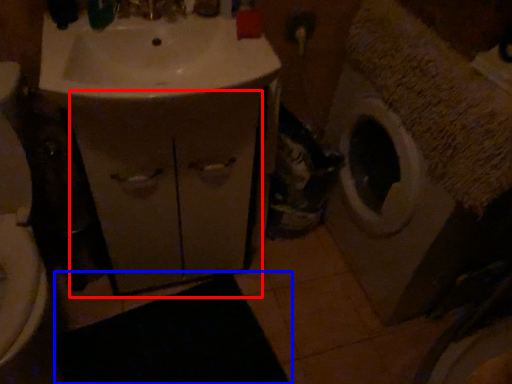
Question: Which object appears farthest to the camera in this image, drawer (highlighted by a red box) or bath mat (highlighted by a blue box)?

Choices:
 (A) drawer
 (B) bath mat

Answer: (B)